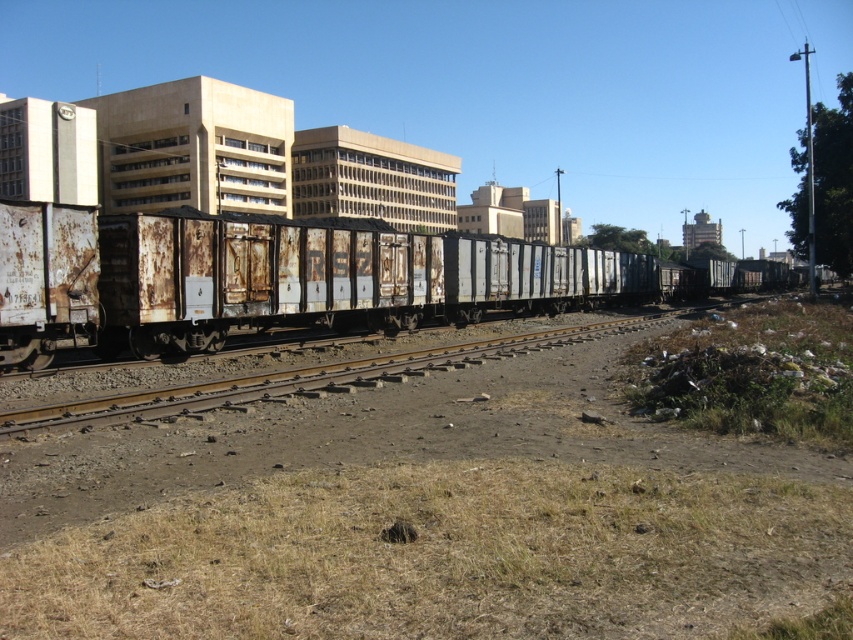
Question: Is rusty metal train carriages at left to the left of rusty metal train carriages at center from the viewer's perspective?

Choices:
 (A) no
 (B) yes

Answer: (A)

Question: Is rusty metal train carriages at left above rusty metal train carriages at center?

Choices:
 (A) yes
 (B) no

Answer: (A)

Question: Which point is closer to the camera?

Choices:
 (A) (283, 243)
 (B) (277, 380)

Answer: (B)

Question: Which of the following is the closest to the observer?

Choices:
 (A) rusty metal train carriages at center
 (B) rusty metal train carriages at left

Answer: (A)

Question: Is rusty metal train carriages at left wider than rusty metal train carriages at center?

Choices:
 (A) no
 (B) yes

Answer: (B)